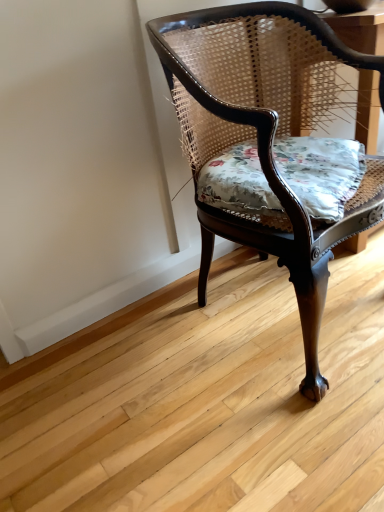
What do you see at coordinates (321, 173) in the screenshot?
I see `floral fabric cushion at center` at bounding box center [321, 173].

Locate an element on the screen. floral fabric cushion at center is located at coordinates click(x=321, y=173).

Describe the element at coordinates (263, 133) in the screenshot. The image size is (384, 512). I see `mahogany cane chair at center` at that location.

This screenshot has height=512, width=384. I want to click on mahogany cane chair at center, so click(263, 133).

Where is `floral fabric cushion at center`? floral fabric cushion at center is located at coordinates (321, 173).

Based on their positions, is mahogany cane chair at center located to the left or right of floral fabric cushion at center?

In the image, mahogany cane chair at center appears on the left side of floral fabric cushion at center.

Is mahogany cane chair at center positioned in front of floral fabric cushion at center?

Yes, it is in front of floral fabric cushion at center.

Which is in front, point (314, 292) or point (200, 200)?

Point (314, 292)

From the image's perspective, which is below, mahogany cane chair at center or floral fabric cushion at center?

From the image's view, mahogany cane chair at center is below.

From a real-world perspective, is mahogany cane chair at center physically located above or below floral fabric cushion at center?

From a real-world perspective, mahogany cane chair at center is physically below floral fabric cushion at center.

Considering the relative sizes of mahogany cane chair at center and floral fabric cushion at center in the image provided, is mahogany cane chair at center wider than floral fabric cushion at center?

Yes.

Does mahogany cane chair at center have a lesser height compared to floral fabric cushion at center?

Incorrect, the height of mahogany cane chair at center does not fall short of that of floral fabric cushion at center.

Considering the sizes of objects mahogany cane chair at center and floral fabric cushion at center in the image provided, who is smaller, mahogany cane chair at center or floral fabric cushion at center?

floral fabric cushion at center.

Is mahogany cane chair at center situated inside floral fabric cushion at center or outside?

mahogany cane chair at center cannot be found inside floral fabric cushion at center.

Is mahogany cane chair at center positioned far away from floral fabric cushion at center?

No, there isn't a large distance between mahogany cane chair at center and floral fabric cushion at center.

Is mahogany cane chair at center looking in the opposite direction of floral fabric cushion at center?

Yes.

Can you tell me how much mahogany cane chair at center and floral fabric cushion at center differ in facing direction?

The angle between the facing direction of mahogany cane chair at center and the facing direction of floral fabric cushion at center is 12.7 degrees.

Where is `pillow behind the mahogany cane chair at center`? The width and height of the screenshot is (384, 512). pillow behind the mahogany cane chair at center is located at coordinates (321, 173).

Does floral fabric cushion at center appear on the right side of mahogany cane chair at center?

Correct, you'll find floral fabric cushion at center to the right of mahogany cane chair at center.

Is floral fabric cushion at center in front of or behind mahogany cane chair at center in the image?

floral fabric cushion at center is behind mahogany cane chair at center.

Does point (280, 203) come behind point (174, 62)?

No.

From the image's perspective, is floral fabric cushion at center positioned above or below mahogany cane chair at center?

floral fabric cushion at center is above mahogany cane chair at center.

From a real-world perspective, between floral fabric cushion at center and mahogany cane chair at center, who is vertically higher?

floral fabric cushion at center, from a real-world perspective.

Which of these two, floral fabric cushion at center or mahogany cane chair at center, is thinner?

With smaller width is floral fabric cushion at center.

Which of these two, floral fabric cushion at center or mahogany cane chair at center, stands shorter?

floral fabric cushion at center.

Which of these two, floral fabric cushion at center or mahogany cane chair at center, is smaller?

With smaller size is floral fabric cushion at center.

Is floral fabric cushion at center inside or outside of mahogany cane chair at center?

floral fabric cushion at center is contained in mahogany cane chair at center.

Are floral fabric cushion at center and mahogany cane chair at center making contact?

No, floral fabric cushion at center is not making contact with mahogany cane chair at center.

Is floral fabric cushion at center oriented away from mahogany cane chair at center?

Yes, mahogany cane chair at center is at the back of floral fabric cushion at center.

What's the angular difference between floral fabric cushion at center and mahogany cane chair at center's facing directions?

The angular difference between floral fabric cushion at center and mahogany cane chair at center is 12.7 degrees.

This screenshot has height=512, width=384. I want to click on chair located underneath the floral fabric cushion at center (from a real-world perspective), so click(263, 133).

Locate an element on the screen. The height and width of the screenshot is (512, 384). chair below the floral fabric cushion at center (from the image's perspective) is located at coordinates (263, 133).

Find the location of a particular element. Image resolution: width=384 pixels, height=512 pixels. pillow behind the mahogany cane chair at center is located at coordinates (321, 173).